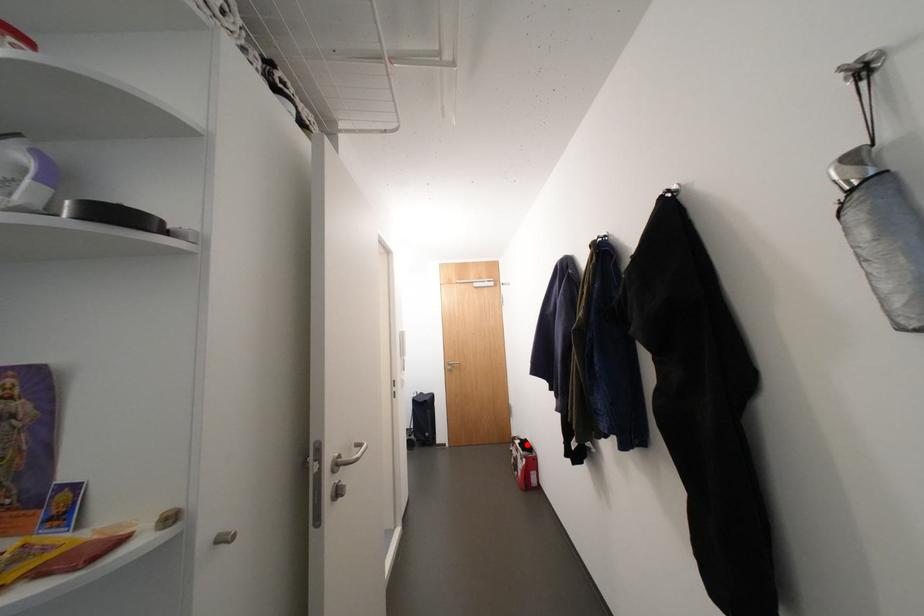
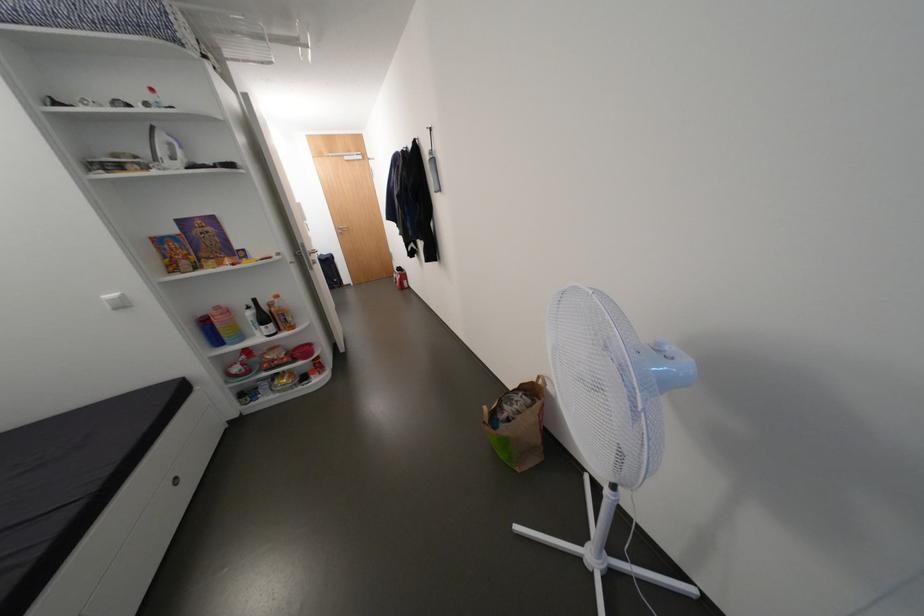
The point at the highlighted location is marked in the first image. Where is the corresponding point in the second image?

(405, 270)